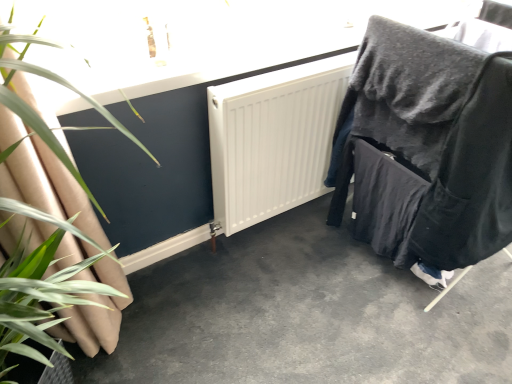
Question: From a real-world perspective, does green leafy plant at left sit lower than velvet black chair at right?

Choices:
 (A) yes
 (B) no

Answer: (B)

Question: Can you confirm if green leafy plant at left is taller than velvet black chair at right?

Choices:
 (A) yes
 (B) no

Answer: (A)

Question: Is green leafy plant at left bigger than velvet black chair at right?

Choices:
 (A) yes
 (B) no

Answer: (B)

Question: Can we say green leafy plant at left lies outside velvet black chair at right?

Choices:
 (A) yes
 (B) no

Answer: (A)

Question: Is the surface of green leafy plant at left in direct contact with velvet black chair at right?

Choices:
 (A) yes
 (B) no

Answer: (B)

Question: From a real-world perspective, is green leafy plant at left physically located above or below smooth concrete floor at center?

Choices:
 (A) below
 (B) above

Answer: (B)

Question: Is green leafy plant at left inside or outside of smooth concrete floor at center?

Choices:
 (A) inside
 (B) outside

Answer: (B)

Question: Looking at the image, does green leafy plant at left seem bigger or smaller compared to smooth concrete floor at center?

Choices:
 (A) small
 (B) big

Answer: (B)

Question: Is green leafy plant at left to the left or to the right of smooth concrete floor at center in the image?

Choices:
 (A) left
 (B) right

Answer: (A)

Question: Considering the positions of smooth concrete floor at center and velvet black chair at right in the image, is smooth concrete floor at center taller or shorter than velvet black chair at right?

Choices:
 (A) tall
 (B) short

Answer: (B)

Question: Considering their positions, is smooth concrete floor at center located in front of or behind velvet black chair at right?

Choices:
 (A) behind
 (B) front

Answer: (B)

Question: Is smooth concrete floor at center to the left or to the right of velvet black chair at right in the image?

Choices:
 (A) right
 (B) left

Answer: (B)

Question: Considering the positions of smooth concrete floor at center and velvet black chair at right in the image, is smooth concrete floor at center wider or thinner than velvet black chair at right?

Choices:
 (A) wide
 (B) thin

Answer: (A)

Question: In terms of height, does velvet black chair at right look taller or shorter compared to smooth concrete floor at center?

Choices:
 (A) short
 (B) tall

Answer: (B)

Question: From a real-world perspective, is velvet black chair at right physically located above or below smooth concrete floor at center?

Choices:
 (A) below
 (B) above

Answer: (B)